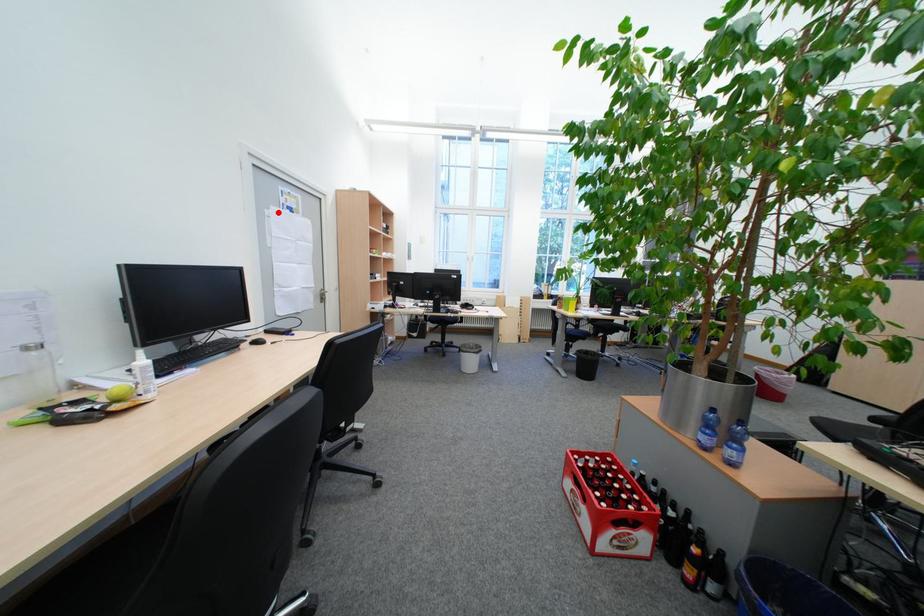
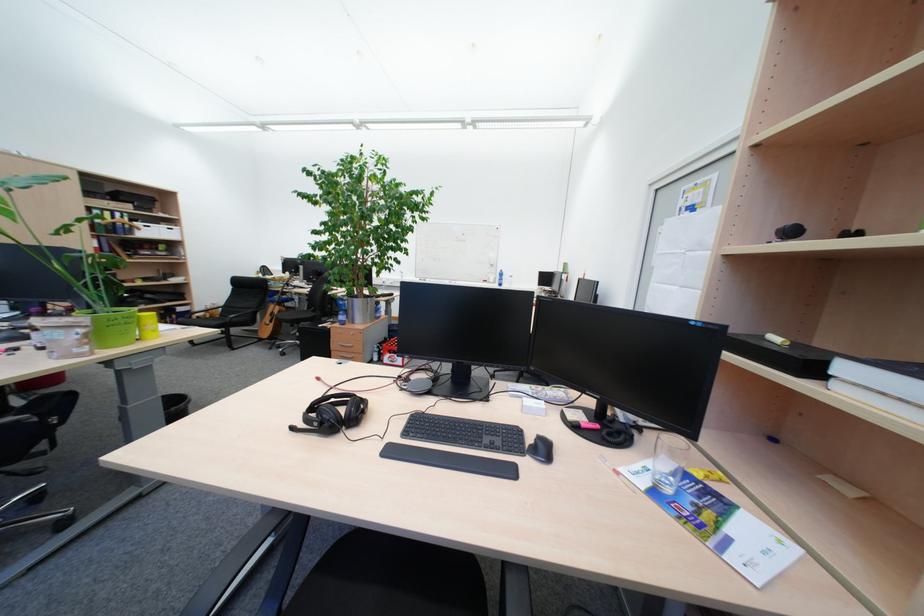
Find the pixel in the second image that matches the highlighted location in the first image.

(671, 230)